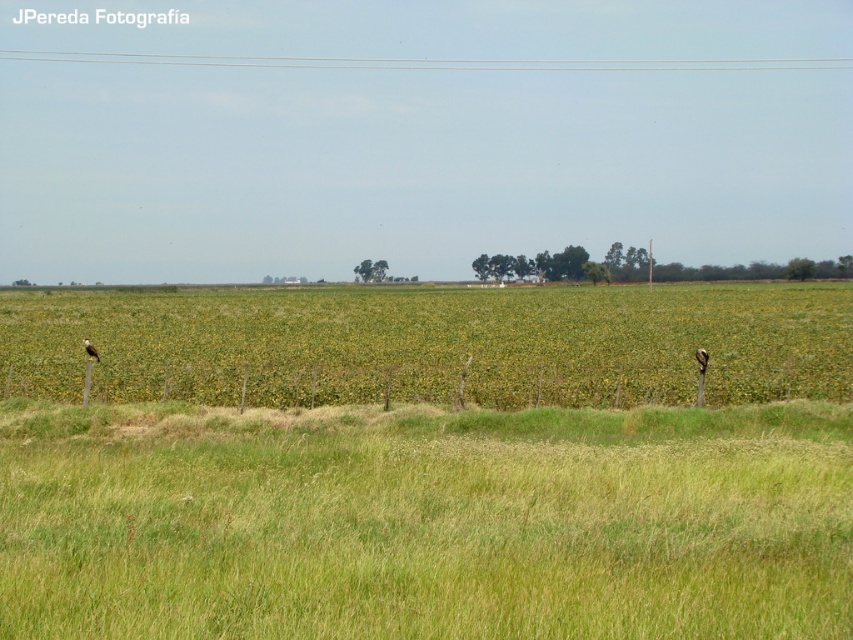
Can you confirm if green grassy field at lower center is shorter than green grass at center?

Indeed, green grassy field at lower center has a lesser height compared to green grass at center.

Does green grassy field at lower center come behind green grass at center?

That is False.

Which is behind, point (12, 412) or point (131, 320)?

Positioned behind is point (131, 320).

The image size is (853, 640). Identify the location of green grassy field at lower center. (425, 522).